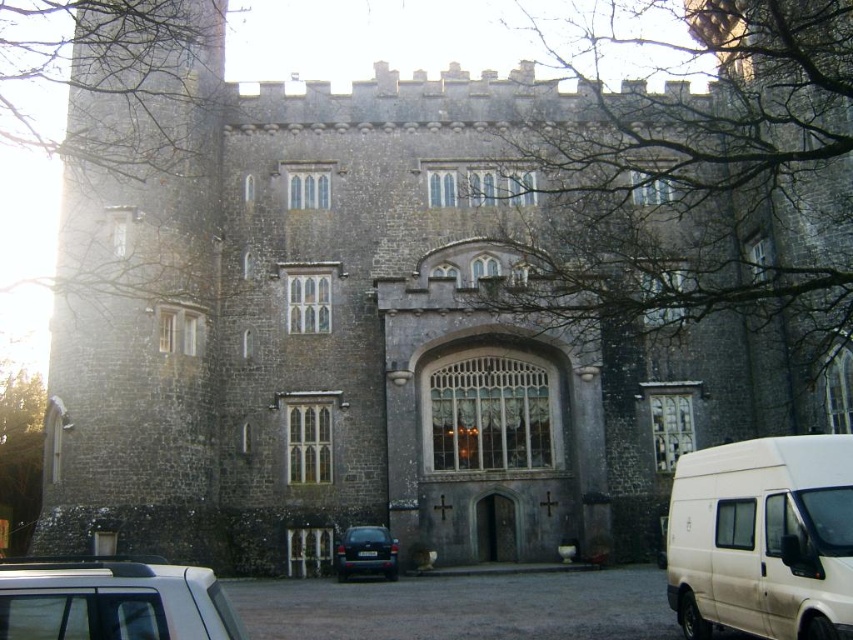
You are a visitor arriving at the castle for a tour. You need to park your car in the courtyard. The white matte van at lower right and the silver metallic car at lower left are already parked there. Based on their positions, which vehicle is closer to the entrance of the castle?

The white matte van at lower right is located below the silver metallic car at lower left, meaning it is closer to the entrance of the castle.

You are standing in the courtyard of the historic stone building. You need to park your car, which is 12 feet long, in the courtyard. Is there enough space between the silver metallic car at lower left and the nearest building wall to park your car?

The silver metallic car at lower left is 110.94 feet away from the viewer, but the question does not provide information about the distance between the car and the nearest building wall. Therefore, it is impossible to determine if there is enough space to park the car.

You are standing in front of the historic stone building and need to park your white matte van at lower right. Where exactly should you position it?

You should position the white matte van at lower right at point (x=763, y=538).